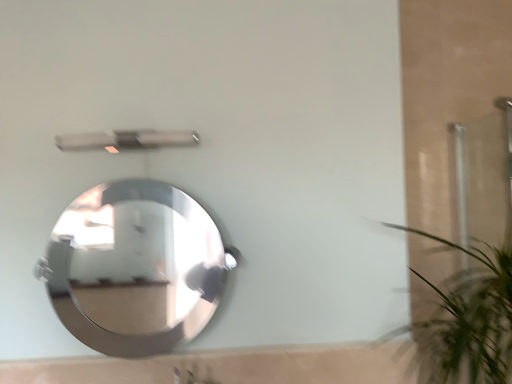
Question: From the image's perspective, is green leafy plant at right above or below polished silver mirror at center?

Choices:
 (A) below
 (B) above

Answer: (A)

Question: From a real-world perspective, is green leafy plant at right positioned above or below polished silver mirror at center?

Choices:
 (A) above
 (B) below

Answer: (B)

Question: Which object is positioned farthest from the metallic silver shower at upper center?

Choices:
 (A) polished silver mirror at center
 (B) green leafy plant at right

Answer: (A)

Question: Which object is positioned farthest from the polished silver mirror at center?

Choices:
 (A) green leafy plant at right
 (B) metallic silver shower at upper center

Answer: (A)